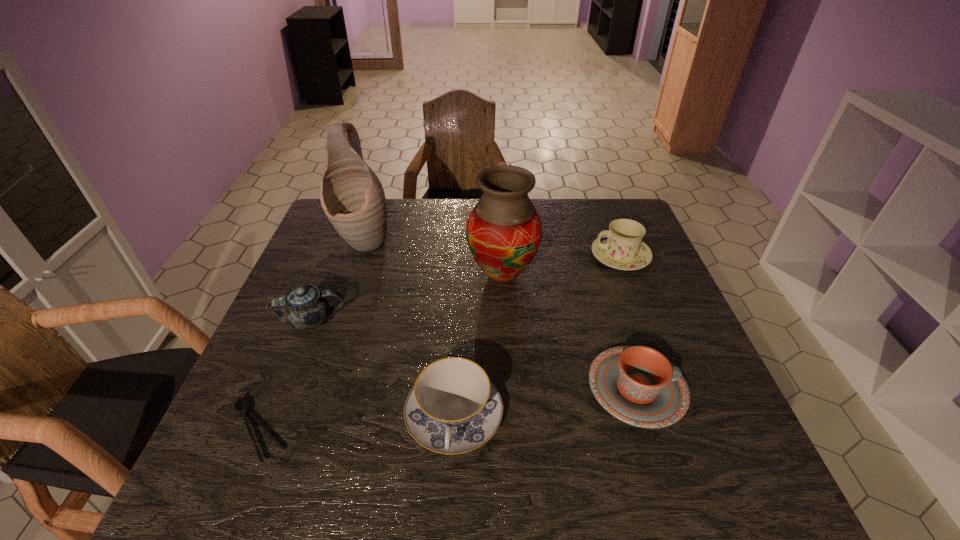
In the image, there is a desktop. In order to click on free space at the right edge in this screenshot , I will do `click(653, 312)`.

Where is `vacant space at the near left corner`? vacant space at the near left corner is located at coordinates (202, 488).

Where is `blank area at the far right corner`? This screenshot has width=960, height=540. blank area at the far right corner is located at coordinates (613, 212).

Locate an element on the screen. Image resolution: width=960 pixels, height=540 pixels. vacant space at the near right corner is located at coordinates (757, 465).

The width and height of the screenshot is (960, 540). In order to click on vacant area between the tallest object and the shortest object in this screenshot , I will do `click(310, 335)`.

Where is `blank region between the sixth shortest object and the farthest chinaware`? Image resolution: width=960 pixels, height=540 pixels. blank region between the sixth shortest object and the farthest chinaware is located at coordinates (562, 266).

Locate an element on the screen. The height and width of the screenshot is (540, 960). vacant area between the third chinaware from right to left and the third nearest chinaware is located at coordinates (383, 369).

The width and height of the screenshot is (960, 540). In order to click on vacant area that lies between the vase and the farthest chinaware in this screenshot , I will do `click(562, 266)`.

Image resolution: width=960 pixels, height=540 pixels. What are the coordinates of `free area in between the tongs and the farthest chinaware` in the screenshot? It's located at (439, 343).

Locate an element on the screen. This screenshot has height=540, width=960. unoccupied area between the third chinaware from right to left and the tongs is located at coordinates (355, 423).